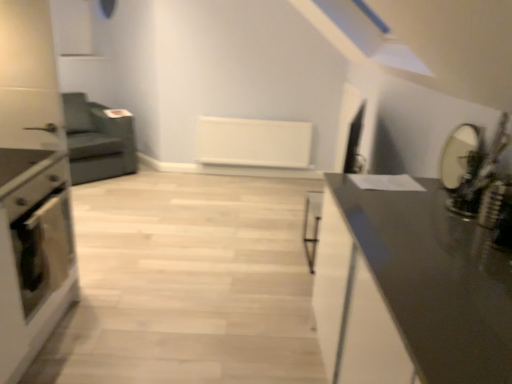
Question: Considering the positions of matte black mirror at right and brushed metal drawer at left in the image, is matte black mirror at right wider or thinner than brushed metal drawer at left?

Choices:
 (A) thin
 (B) wide

Answer: (A)

Question: From a real-world perspective, is matte black mirror at right physically located above or below brushed metal drawer at left?

Choices:
 (A) above
 (B) below

Answer: (A)

Question: Which is nearer to the white matte radiator at center?

Choices:
 (A) matte black oven at left
 (B) matte black mirror at right
 (C) brushed metal drawer at left
 (D) matte black oven at left
 (E) dark gray fabric armchair at left

Answer: (E)

Question: Estimate the real-world distances between objects in this image. Which object is farther from the brushed metal drawer at left?

Choices:
 (A) dark gray fabric armchair at left
 (B) matte black mirror at right
 (C) white matte radiator at center
 (D) matte black oven at left
 (E) matte black oven at left

Answer: (C)